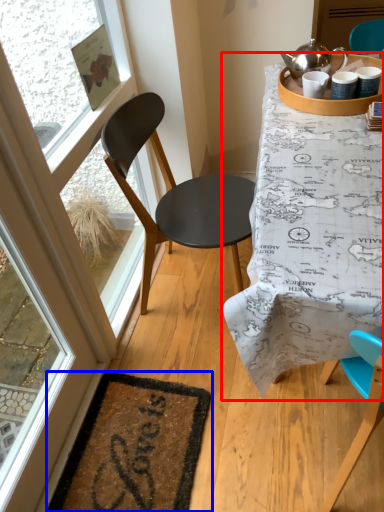
Question: Which object is closer to the camera taking this photo, table (highlighted by a red box) or mat (highlighted by a blue box)?

Choices:
 (A) table
 (B) mat

Answer: (A)